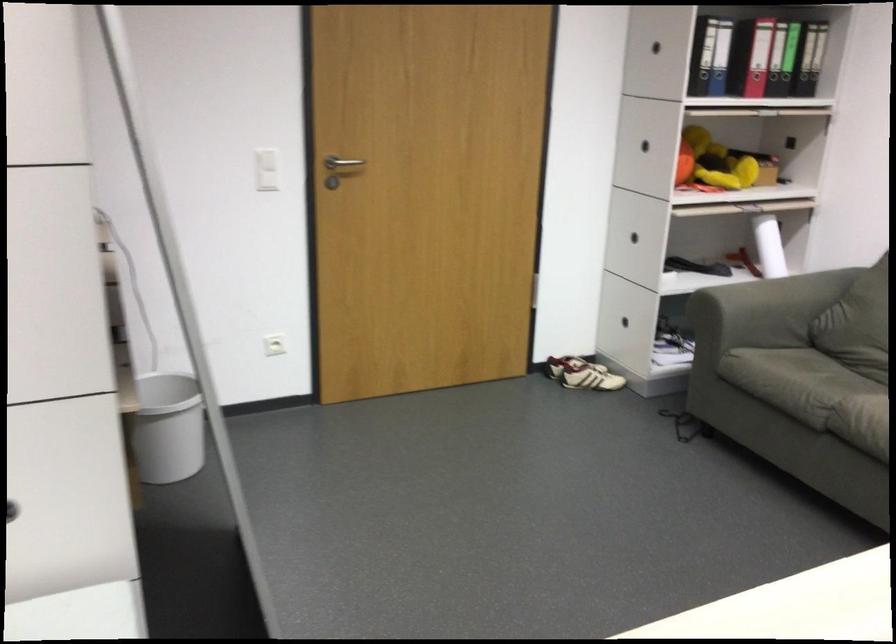
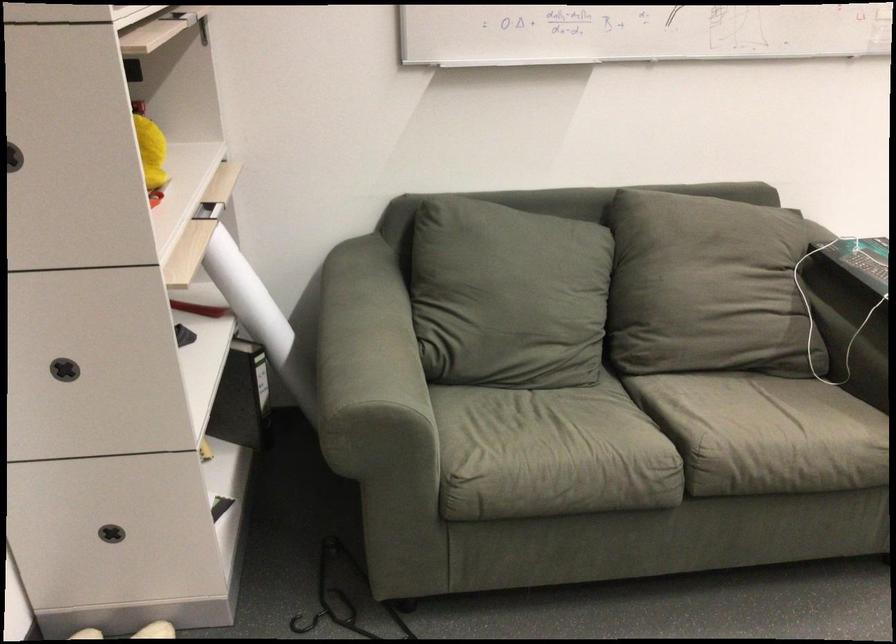
In the second image, find the point that corresponds to the point at 744,162 in the first image.

(151, 152)